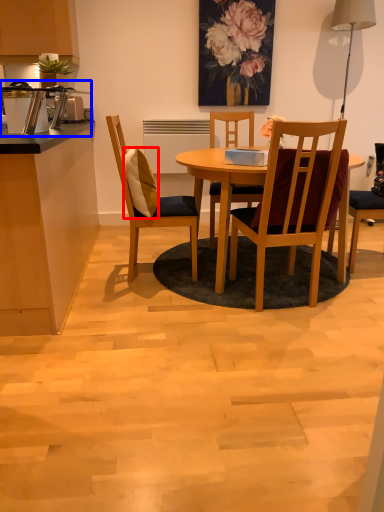
Question: Which object appears farthest to the camera in this image, pillow (highlighted by a red box) or appliance (highlighted by a blue box)?

Choices:
 (A) pillow
 (B) appliance

Answer: (A)